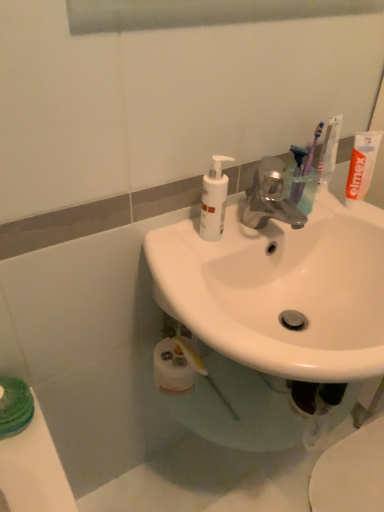
Question: From the image's perspective, is translucent plastic toothbrush at upper right, placed as the first toothbrush when sorted from left to right, below white matte toothpaste at upper right?

Choices:
 (A) yes
 (B) no

Answer: (A)

Question: From the image's perspective, is translucent plastic toothbrush at upper right, positioned as the third toothbrush in right-to-left order, located above white matte toothpaste at upper right?

Choices:
 (A) no
 (B) yes

Answer: (A)

Question: Are translucent plastic toothbrush at upper right, placed as the first toothbrush when sorted from left to right, and white matte toothpaste at upper right beside each other?

Choices:
 (A) no
 (B) yes

Answer: (A)

Question: Is translucent plastic toothbrush at upper right, positioned as the third toothbrush in right-to-left order, wider than white matte toothpaste at upper right?

Choices:
 (A) yes
 (B) no

Answer: (B)

Question: Is white glossy sink at center inside the boundaries of white matte pump bottle at upper center, or outside?

Choices:
 (A) inside
 (B) outside

Answer: (B)

Question: Considering the positions of white glossy sink at center and white matte pump bottle at upper center in the image, is white glossy sink at center wider or thinner than white matte pump bottle at upper center?

Choices:
 (A) thin
 (B) wide

Answer: (B)

Question: From their relative heights in the image, would you say white glossy sink at center is taller or shorter than white matte pump bottle at upper center?

Choices:
 (A) tall
 (B) short

Answer: (A)

Question: Is point (213, 303) closer or farther from the camera than point (208, 205)?

Choices:
 (A) farther
 (B) closer

Answer: (B)

Question: In the image, is white glossy sink at center positioned in front of or behind white glossy toilet at lower right?

Choices:
 (A) front
 (B) behind

Answer: (A)

Question: Based on their sizes in the image, would you say white glossy sink at center is bigger or smaller than white glossy toilet at lower right?

Choices:
 (A) big
 (B) small

Answer: (A)

Question: Is white glossy sink at center inside the boundaries of white glossy toilet at lower right, or outside?

Choices:
 (A) inside
 (B) outside

Answer: (B)

Question: From a real-world perspective, is white glossy sink at center positioned above or below white glossy toilet at lower right?

Choices:
 (A) above
 (B) below

Answer: (A)

Question: From a real-world perspective, is translucent plastic toothbrush at upper right, placed as the first toothbrush when sorted from left to right, positioned above or below white matte toothpaste at upper right?

Choices:
 (A) above
 (B) below

Answer: (B)

Question: Does point (301, 187) appear closer or farther from the camera than point (355, 156)?

Choices:
 (A) farther
 (B) closer

Answer: (A)